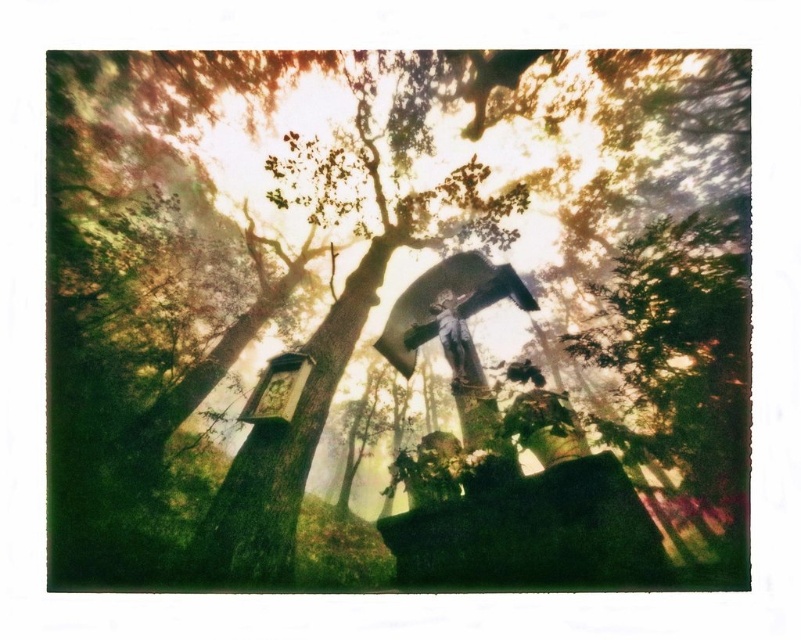
Does green textured tree at center have a lesser width compared to metallic statue at center?

Incorrect, green textured tree at center's width is not less than metallic statue at center's.

Who is higher up, green textured tree at center or metallic statue at center?

metallic statue at center

Who is more forward, (x=614, y=416) or (x=455, y=346)?

Point (x=455, y=346)

Locate an element on the screen. green textured tree at center is located at coordinates (397, 317).